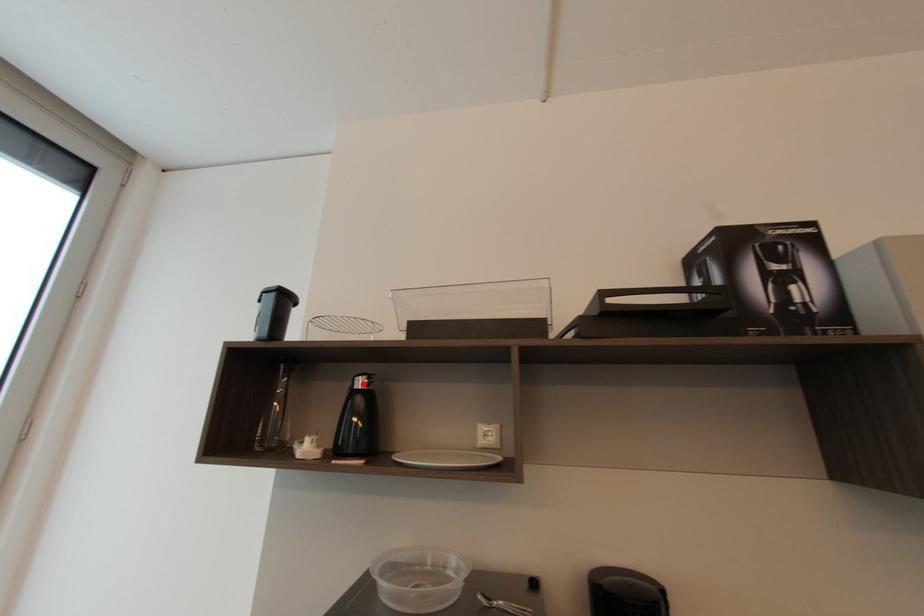
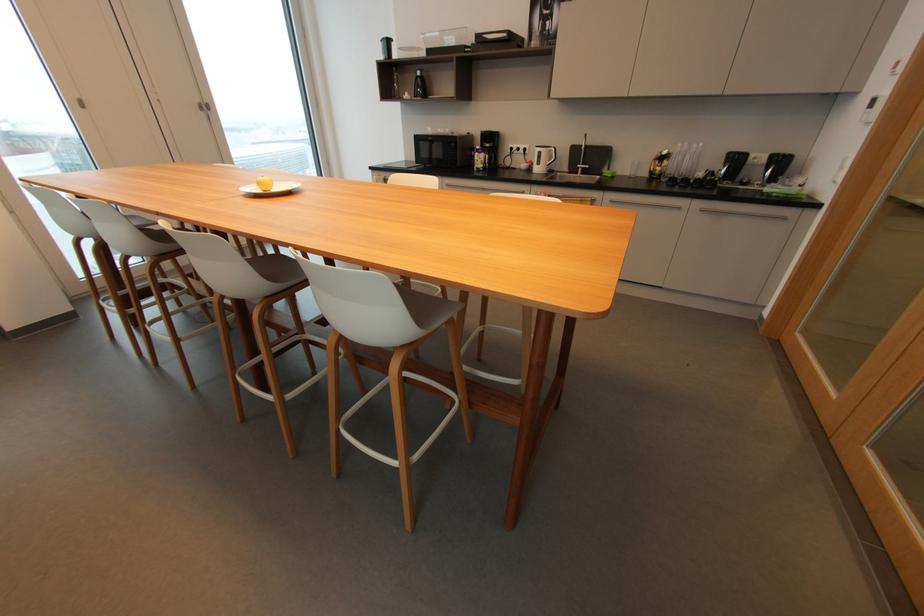
Question: I am providing you with two images of the same scene from different viewpoints. In image1, a red point is highlighted. Considering the same 3D point in image2, which of the following is correct?

Choices:
 (A) It is closer
 (B) It is farther

Answer: (A)